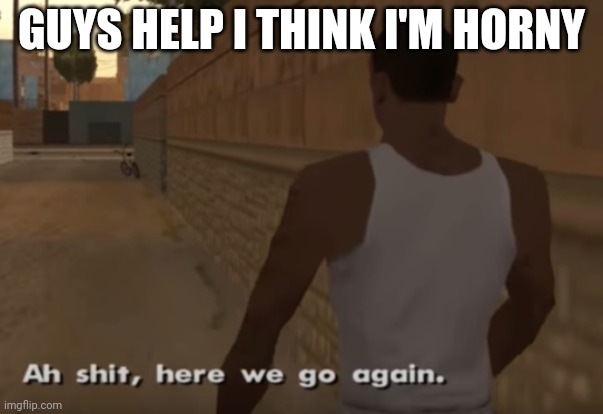
Identify the location of brown and beige brick wall. (242, 97), (500, 99), (560, 327), (241, 231), (137, 151), (143, 116).